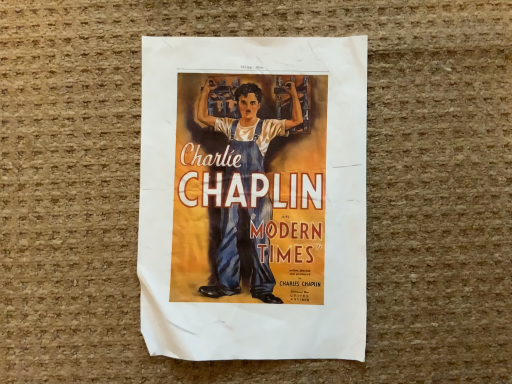
This screenshot has height=384, width=512. Describe the element at coordinates (253, 197) in the screenshot. I see `matte paper poster at center` at that location.

Where is `matte paper poster at center`? The width and height of the screenshot is (512, 384). matte paper poster at center is located at coordinates (253, 197).

Where is `matte paper poster at center`? This screenshot has height=384, width=512. matte paper poster at center is located at coordinates (253, 197).